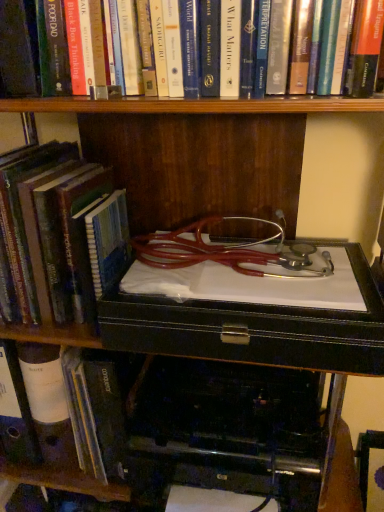
Question: From the image's perspective, is hardcover book at left, which is counted as the second book, starting from the top, on top of hardcover book at upper center, the 3th book from the bottom?

Choices:
 (A) yes
 (B) no

Answer: (B)

Question: Can you confirm if hardcover book at left, marked as the 2th book in a bottom-to-top arrangement, is smaller than hardcover book at upper center, which is the 1th book in top-to-bottom order?

Choices:
 (A) yes
 (B) no

Answer: (B)

Question: Can you confirm if hardcover book at left, which is counted as the second book, starting from the top, is bigger than hardcover book at upper center, which is the 1th book in top-to-bottom order?

Choices:
 (A) yes
 (B) no

Answer: (A)

Question: Is hardcover book at left, marked as the 2th book in a bottom-to-top arrangement, further to camera compared to hardcover book at upper center, the 3th book from the bottom?

Choices:
 (A) yes
 (B) no

Answer: (A)

Question: Can you see hardcover book at left, which is counted as the second book, starting from the top, touching hardcover book at upper center, the 3th book from the bottom?

Choices:
 (A) no
 (B) yes

Answer: (A)

Question: From the image's perspective, is hardcover book at left, which is the 1th book from bottom to top, positioned above or below hardcover book at upper center, which is the 1th book in top-to-bottom order?

Choices:
 (A) below
 (B) above

Answer: (A)

Question: In the image, is hardcover book at left, which is the 1th book from bottom to top, on the left side or the right side of hardcover book at upper center, the 3th book from the bottom?

Choices:
 (A) left
 (B) right

Answer: (A)

Question: Is hardcover book at left, the 3th book viewed from the top, bigger or smaller than hardcover book at upper center, the 3th book from the bottom?

Choices:
 (A) big
 (B) small

Answer: (B)

Question: Is hardcover book at left, the 3th book viewed from the top, spatially inside hardcover book at upper center, which is the 1th book in top-to-bottom order, or outside of it?

Choices:
 (A) inside
 (B) outside

Answer: (B)

Question: Is black plastic printer at lower center spatially inside hardcover book at left, the 3th book viewed from the top, or outside of it?

Choices:
 (A) outside
 (B) inside

Answer: (A)

Question: Would you say black plastic printer at lower center is to the left or to the right of hardcover book at left, the 3th book viewed from the top, in the picture?

Choices:
 (A) left
 (B) right

Answer: (B)

Question: Considering the positions of point (210, 324) and point (64, 357), is point (210, 324) closer or farther from the camera than point (64, 357)?

Choices:
 (A) closer
 (B) farther

Answer: (A)

Question: From a real-world perspective, is black plastic printer at lower center positioned above or below hardcover book at left, which is the 1th book from bottom to top?

Choices:
 (A) above
 (B) below

Answer: (B)

Question: Visually, is hardcover book at left, which is the 1th book from bottom to top, positioned to the left or to the right of black plastic printer at lower center?

Choices:
 (A) right
 (B) left

Answer: (B)

Question: From a real-world perspective, is hardcover book at left, which is the 1th book from bottom to top, above or below black plastic printer at lower center?

Choices:
 (A) above
 (B) below

Answer: (A)